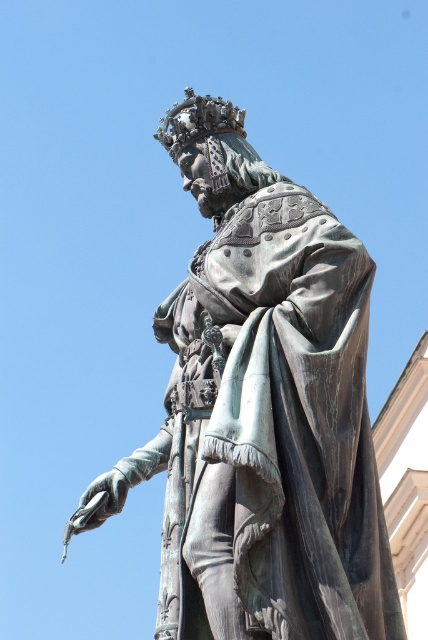
Can you confirm if bronze statue at center is taller than shiny gold crown at upper center?

Yes.

Who is taller, bronze statue at center or shiny gold crown at upper center?

With more height is bronze statue at center.

Is point (321, 580) less distant than point (157, 138)?

Yes, it is in front of point (157, 138).

You are a GUI agent. You are given a task and a screenshot of the screen. Output one action in this format:
    pyautogui.click(x=<x>, y=<y>)
    Task: Click on the bronze statue at center
    The image size is (428, 640).
    Given the screenshot: What is the action you would take?
    [x=264, y=422]